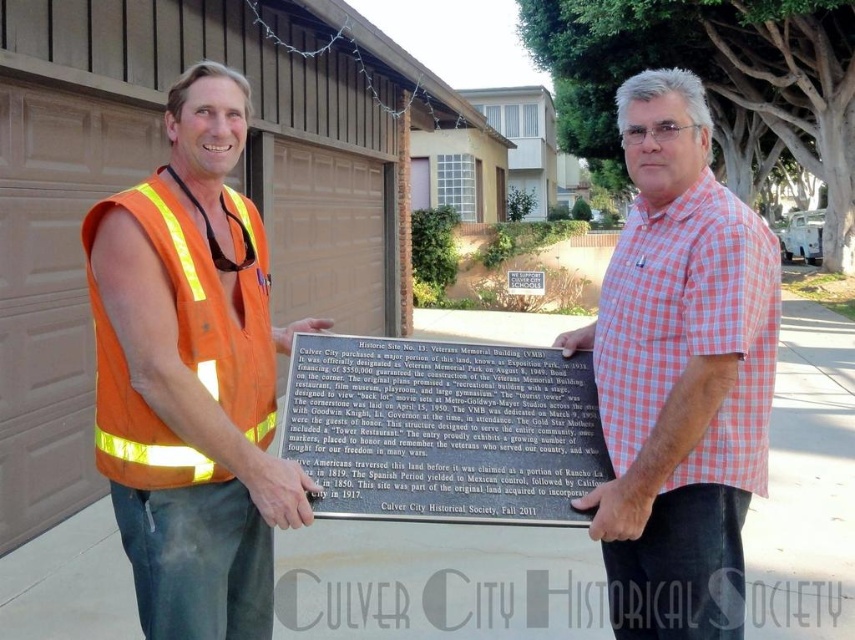
Between hi-visibility orange vest at left and orange reflective safety vest at left, which one is positioned lower?

hi-visibility orange vest at left

Between hi-visibility orange vest at left and orange reflective safety vest at left, which one has less height?

With less height is orange reflective safety vest at left.

Is point (154, 557) behind point (267, 435)?

No.

Where is `hi-visibility orange vest at left`? Image resolution: width=855 pixels, height=640 pixels. hi-visibility orange vest at left is located at coordinates (192, 376).

Does pink checkered shirt at center have a greater height compared to black polished stone plaque at center?

Yes, pink checkered shirt at center is taller than black polished stone plaque at center.

Identify the location of pink checkered shirt at center. The width and height of the screenshot is (855, 640). click(x=679, y=372).

Is hi-visibility orange vest at left smaller than black polished stone plaque at center?

No, hi-visibility orange vest at left is not smaller than black polished stone plaque at center.

Describe the element at coordinates (192, 376) in the screenshot. The height and width of the screenshot is (640, 855). I see `hi-visibility orange vest at left` at that location.

Which is behind, point (198, 72) or point (345, 506)?

Positioned behind is point (198, 72).

Where is `hi-visibility orange vest at left`? Image resolution: width=855 pixels, height=640 pixels. hi-visibility orange vest at left is located at coordinates (192, 376).